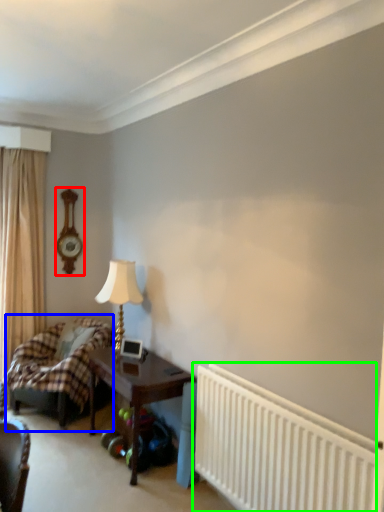
Question: Based on their relative distances, which object is farther from clock (highlighted by a red box)? Choose from bed (highlighted by a blue box) and radiator (highlighted by a green box).

Choices:
 (A) bed
 (B) radiator

Answer: (B)